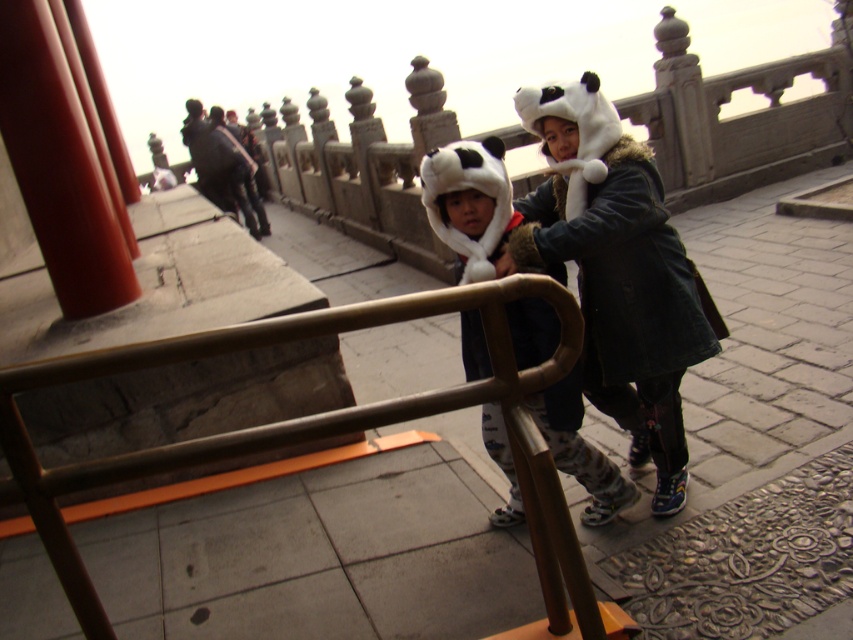
Does metallic rail at center have a greater height compared to white fur hat at center?

Incorrect, metallic rail at center's height is not larger of white fur hat at center's.

Does point (328, 317) come closer to viewer compared to point (554, 225)?

Yes, point (328, 317) is closer to viewer.

You are a GUI agent. You are given a task and a screenshot of the screen. Output one action in this format:
    pyautogui.click(x=<x>, y=<y>)
    Task: Click on the metallic rail at center
    This screenshot has height=640, width=853.
    Given the screenshot: What is the action you would take?
    pyautogui.click(x=325, y=433)

Does white fur hat at center have a lesser height compared to white plush panda hat at center?

In fact, white fur hat at center may be taller than white plush panda hat at center.

Looking at this image, is white fur hat at center to the right of white plush panda hat at center from the viewer's perspective?

Correct, you'll find white fur hat at center to the right of white plush panda hat at center.

Does point (596, 214) lie behind point (599, 506)?

No, (596, 214) is closer to viewer.

Identify the location of white fur hat at center. The width and height of the screenshot is (853, 640). (614, 272).

Does metallic rail at center appear on the left side of white plush panda hat at center?

Yes, metallic rail at center is to the left of white plush panda hat at center.

Which is above, metallic rail at center or white plush panda hat at center?

white plush panda hat at center is higher up.

Does point (489, 292) come behind point (447, 177)?

No.

Image resolution: width=853 pixels, height=640 pixels. In order to click on metallic rail at center in this screenshot , I will do `click(325, 433)`.